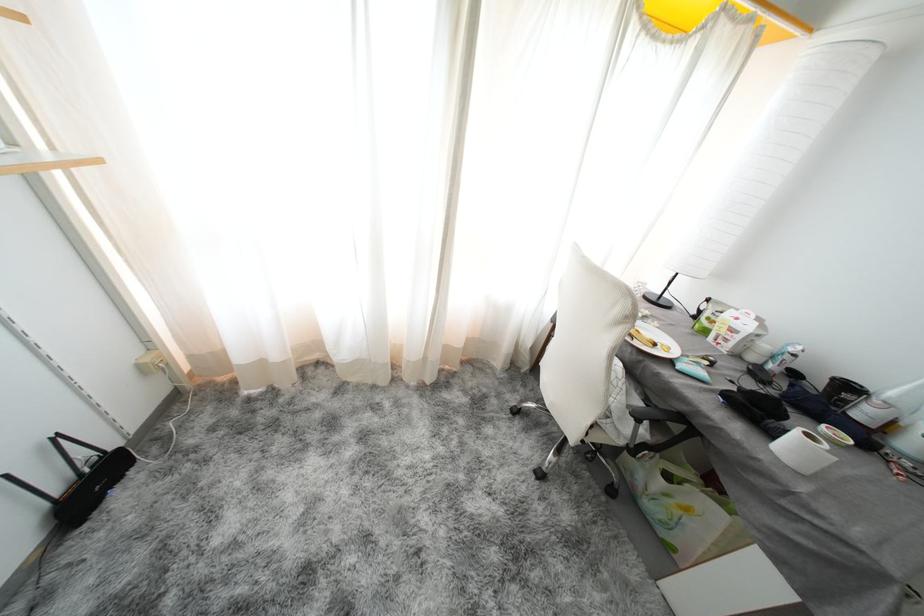
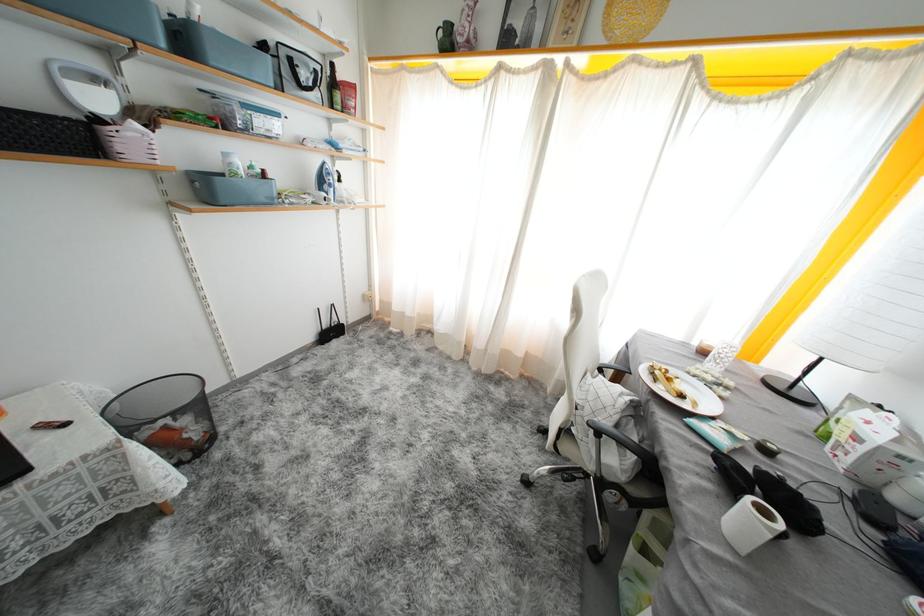
In the second image, find the point that corresponds to (661,349) in the first image.

(687, 400)